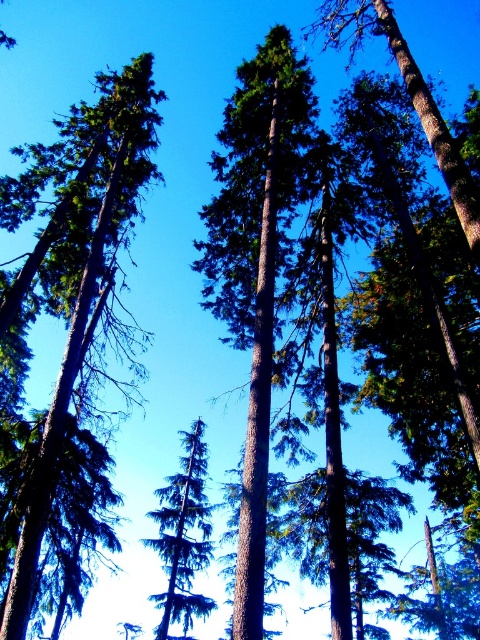
Identify the location of green textured tree at center. (254, 266).

The image size is (480, 640). What are the coordinates of `green textured tree at center` in the screenshot? It's located at (254, 266).

Is point (13, 584) less distant than point (188, 563)?

Yes, it is in front of point (188, 563).

Does green rough bark tree at center have a smaller size compared to green matte tree at center?

Yes.

Describe the element at coordinates (75, 346) in the screenshot. I see `green rough bark tree at center` at that location.

Identify the location of green rough bark tree at center. (75, 346).

Is green textured tree at center bigger than green rough bark tree at center?

Yes.

Does green textured tree at center have a lesser height compared to green rough bark tree at center?

Incorrect, green textured tree at center's height does not fall short of green rough bark tree at center's.

Identify the location of green textured tree at center. (254, 266).